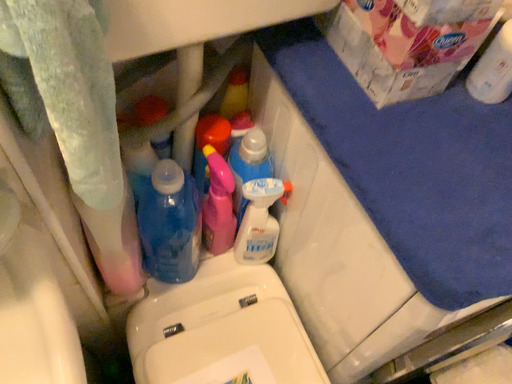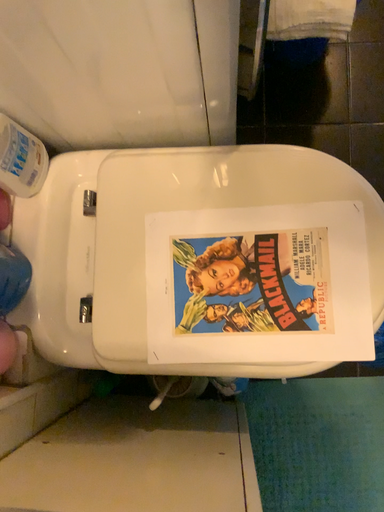
Question: How did the camera likely rotate when shooting the video?

Choices:
 (A) rotated left
 (B) rotated right

Answer: (B)